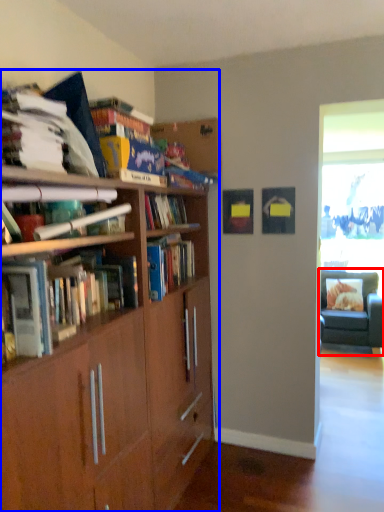
Question: Which object is closer to the camera taking this photo, chair (highlighted by a red box) or bookcase (highlighted by a blue box)?

Choices:
 (A) chair
 (B) bookcase

Answer: (B)